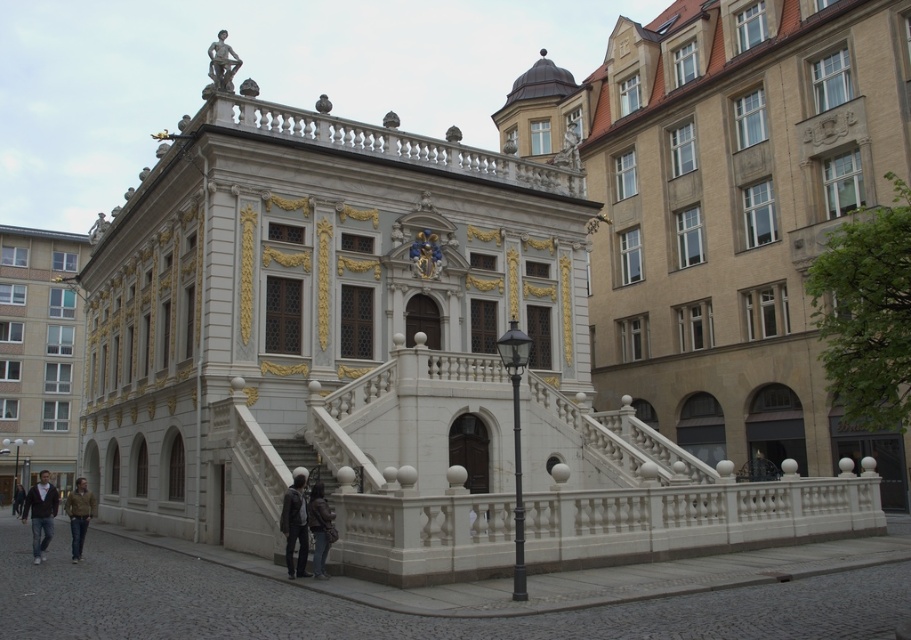
Does beige stone building at center appear on the left side of white stone palace at lower left?

Incorrect, beige stone building at center is not on the left side of white stone palace at lower left.

Is beige stone building at center taller than white stone palace at lower left?

Correct, beige stone building at center is much taller as white stone palace at lower left.

The height and width of the screenshot is (640, 911). In order to click on beige stone building at center in this screenshot , I will do `click(729, 211)`.

I want to click on beige stone building at center, so click(729, 211).

Between white stone palace at lower left and dark brown sweater at lower left, which one is positioned higher?

white stone palace at lower left is above.

Does white stone palace at lower left have a greater height compared to dark brown sweater at lower left?

Indeed, white stone palace at lower left has a greater height compared to dark brown sweater at lower left.

Is point (38, 422) positioned after point (22, 518)?

Yes, point (38, 422) is farther from viewer.

At what (x,y) coordinates should I click in order to perform the action: click on white stone palace at lower left. Please return your answer as a coordinate pair (x, y). This screenshot has width=911, height=640. Looking at the image, I should click on pos(38,355).

Which is more to the right, dark gray jacket at lower center or dark brown leather jacket at lower center?

dark brown leather jacket at lower center

Does dark gray jacket at lower center appear under dark brown leather jacket at lower center?

No.

Which is in front, point (283, 513) or point (325, 528)?

Point (325, 528) is more forward.

I want to click on dark gray jacket at lower center, so click(295, 525).